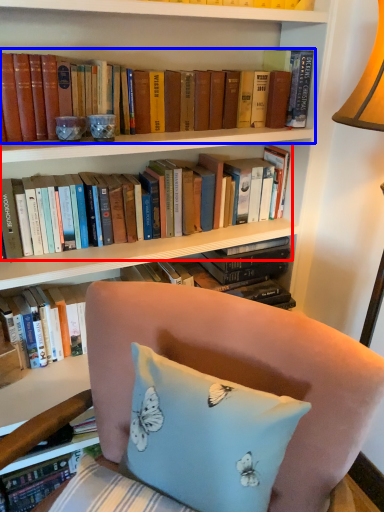
Question: Which object is further to the camera taking this photo, book (highlighted by a red box) or book (highlighted by a blue box)?

Choices:
 (A) book
 (B) book

Answer: (A)